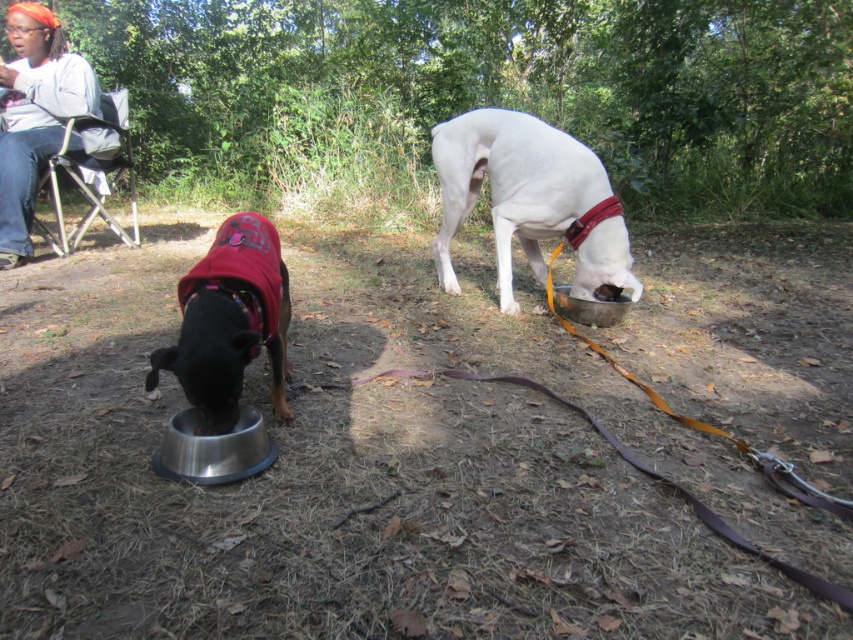
Image resolution: width=853 pixels, height=640 pixels. In order to click on white matte dog bowl at center in this screenshot , I will do `click(511, 188)`.

Looking at this image, can you confirm if white matte dog bowl at center is positioned below shiny black dog at lower left?

No.

The image size is (853, 640). Describe the element at coordinates (511, 188) in the screenshot. I see `white matte dog bowl at center` at that location.

What are the coordinates of `white matte dog bowl at center` in the screenshot? It's located at (511, 188).

Does point (177, 362) lie behind point (564, 316)?

No, (177, 362) is in front of (564, 316).

Does point (155, 371) come in front of point (585, 312)?

Yes.

Between point (259, 291) and point (593, 323), which one is positioned in front?

Point (259, 291) is in front.

Identify the location of shiny black dog at lower left. (230, 321).

Is white matte dog bowl at center to the left of stainless steel bowl at center from the viewer's perspective?

Yes, white matte dog bowl at center is to the left of stainless steel bowl at center.

Which is in front, point (563, 202) or point (598, 317)?

Point (598, 317) is in front.

Is point (625, 266) positioned behind point (563, 296)?

No.

The height and width of the screenshot is (640, 853). What are the coordinates of `white matte dog bowl at center` in the screenshot? It's located at (511, 188).